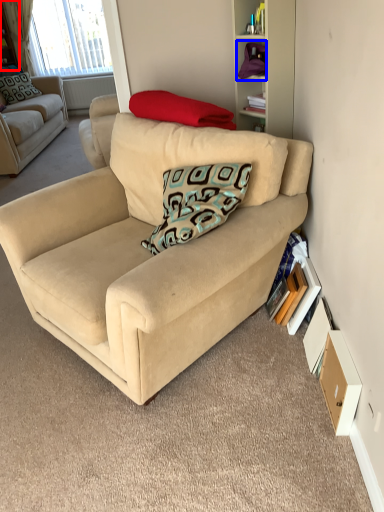
Question: Which object appears closest to the camera in this image, shelf (highlighted by a red box) or shelf (highlighted by a blue box)?

Choices:
 (A) shelf
 (B) shelf

Answer: (B)